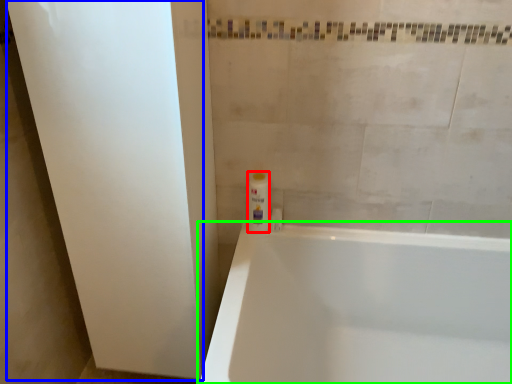
Question: Based on their relative distances, which object is nearer to toiletry (highlighted by a red box)? Choose from screen door (highlighted by a blue box) and bathtub (highlighted by a green box).

Choices:
 (A) screen door
 (B) bathtub

Answer: (B)